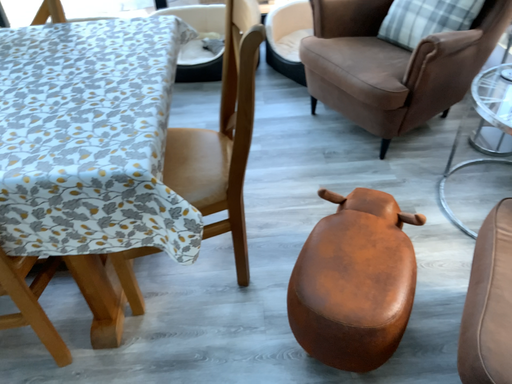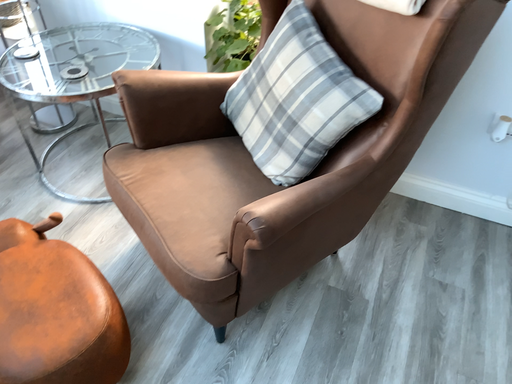
Question: Which way did the camera rotate in the video?

Choices:
 (A) rotated left
 (B) rotated right

Answer: (B)